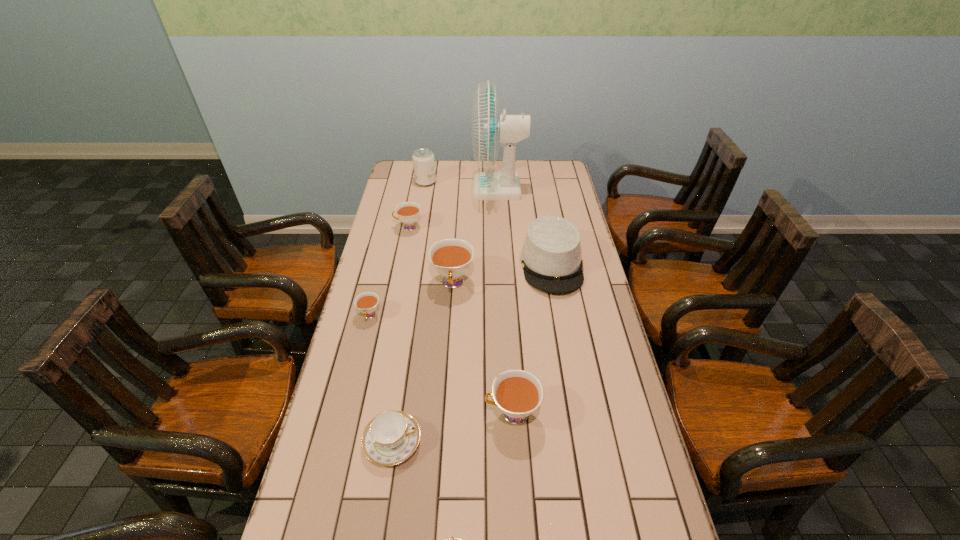
You are a GUI agent. You are given a task and a screenshot of the screen. Output one action in this format:
    pyautogui.click(x=<x>, y=<y>)
    Task: Click on the bigger blue teacup
    The image size is (960, 540).
    Given the screenshot: What is the action you would take?
    pyautogui.click(x=391, y=437)

This screenshot has height=540, width=960. Identify the location of the farther blue teacup. (391, 437).

Find the location of a particular element. Image resolution: width=960 pixels, height=540 pixels. the sixth farthest object is located at coordinates click(x=366, y=302).

Find the location of `the smallest white teacup`. the smallest white teacup is located at coordinates (366, 302).

Where is `vacant area situated 0.180m in front of the tallest object to face the airflow`? vacant area situated 0.180m in front of the tallest object to face the airflow is located at coordinates (434, 188).

This screenshot has width=960, height=540. I want to click on vacant space positioned in front of the tallest object to face the airflow, so click(399, 188).

The width and height of the screenshot is (960, 540). Identify the location of free location located 0.210m in front of the tallest object to face the airflow. (427, 188).

Locate an element on the screen. The width and height of the screenshot is (960, 540). free space located on the right of the soda can is located at coordinates (474, 182).

Image resolution: width=960 pixels, height=540 pixels. I want to click on vacant space located 0.240m on the side of the third nearest white teacup with the handle, so click(x=448, y=358).

The width and height of the screenshot is (960, 540). Find the location of `vacant region located on the front-facing side of the hat`. vacant region located on the front-facing side of the hat is located at coordinates (568, 356).